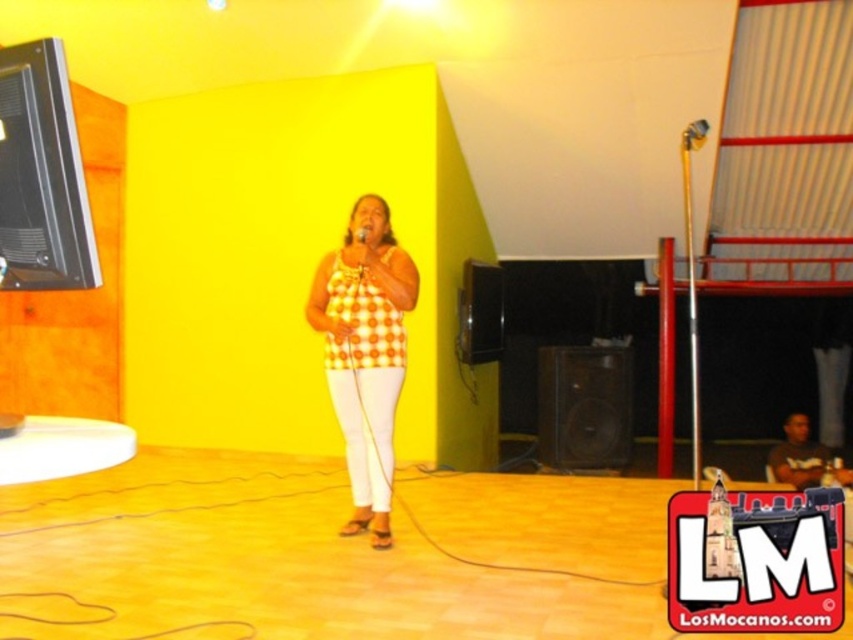
This screenshot has height=640, width=853. Identify the location of yellow checkered tank top at center. (364, 355).

In the scene shown: Which is more to the right, yellow checkered tank top at center or metallic shiny microphone at center?

Positioned to the right is metallic shiny microphone at center.

What do you see at coordinates (364, 355) in the screenshot? This screenshot has width=853, height=640. I see `yellow checkered tank top at center` at bounding box center [364, 355].

Locate an element on the screen. The width and height of the screenshot is (853, 640). yellow checkered tank top at center is located at coordinates (364, 355).